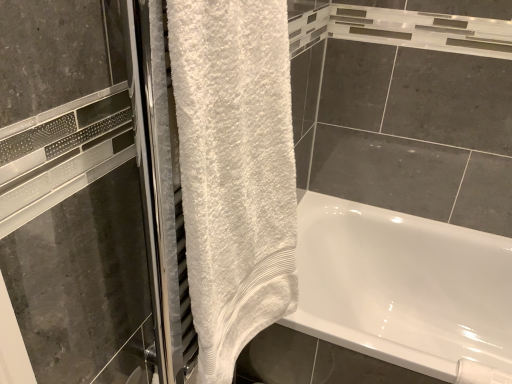
Question: Would you say white glossy bathtub at lower right is inside or outside white fluffy towel at left?

Choices:
 (A) inside
 (B) outside

Answer: (B)

Question: Does point (324, 236) appear closer or farther from the camera than point (264, 33)?

Choices:
 (A) farther
 (B) closer

Answer: (A)

Question: From their relative heights in the image, would you say white glossy bathtub at lower right is taller or shorter than white fluffy towel at left?

Choices:
 (A) tall
 (B) short

Answer: (B)

Question: Considering the relative positions of white fluffy towel at left and white glossy bathtub at lower right in the image provided, is white fluffy towel at left to the left or to the right of white glossy bathtub at lower right?

Choices:
 (A) right
 (B) left

Answer: (B)

Question: Is white fluffy towel at left situated inside white glossy bathtub at lower right or outside?

Choices:
 (A) outside
 (B) inside

Answer: (A)

Question: Is point (189, 77) closer or farther from the camera than point (436, 327)?

Choices:
 (A) closer
 (B) farther

Answer: (A)

Question: From a real-world perspective, is white fluffy towel at left above or below white glossy bathtub at lower right?

Choices:
 (A) above
 (B) below

Answer: (A)